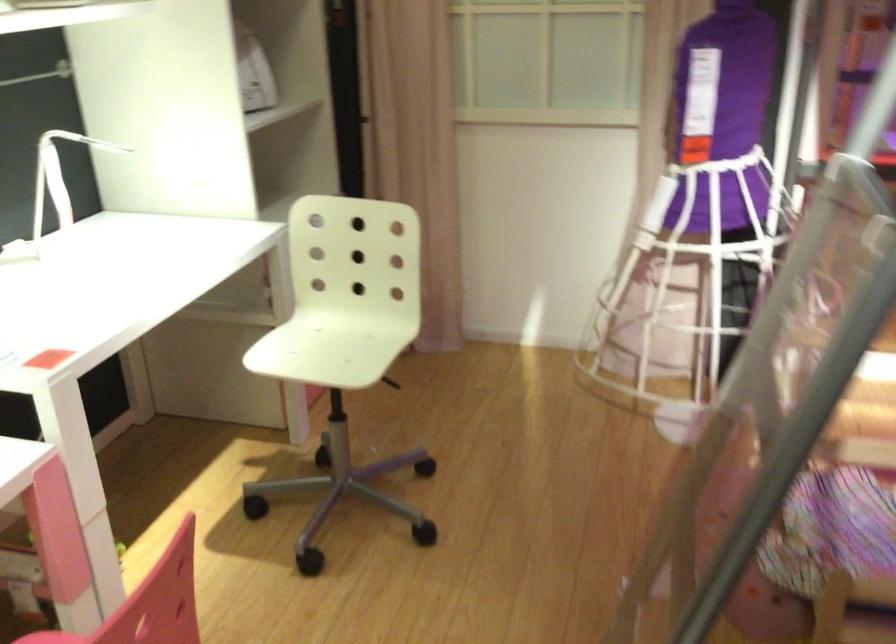
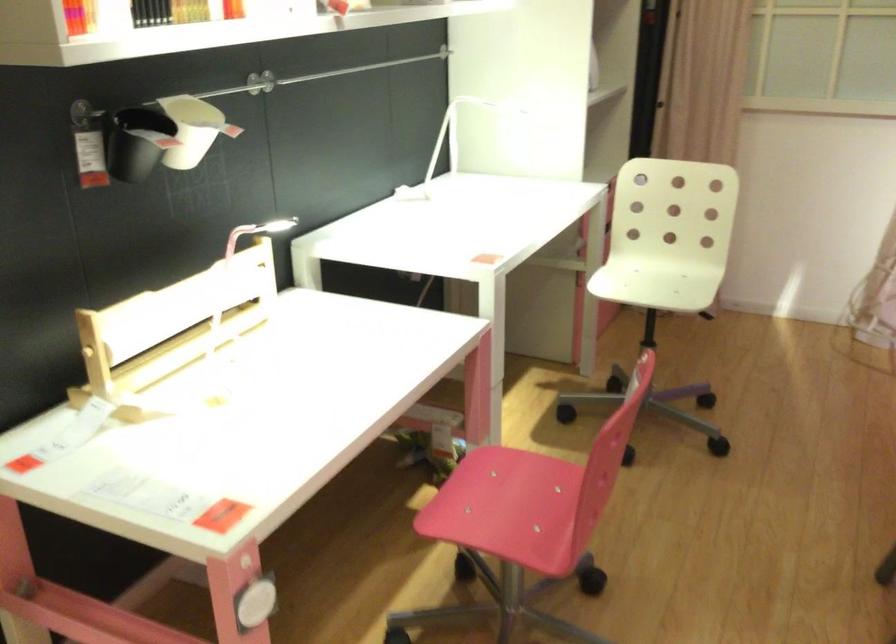
What movement of the cameraman would produce the second image?

The cameraman walked toward left, backward.